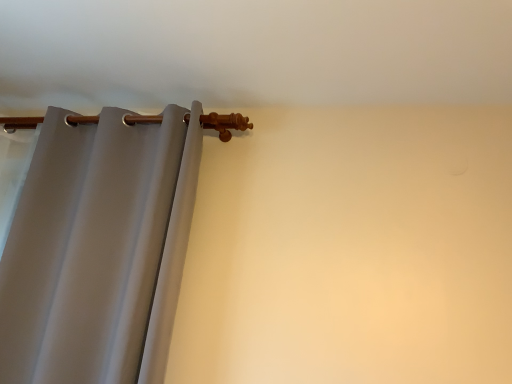
This screenshot has width=512, height=384. In order to click on satin gray curtain at left in this screenshot , I will do `click(100, 244)`.

This screenshot has width=512, height=384. What do you see at coordinates (100, 244) in the screenshot?
I see `satin gray curtain at left` at bounding box center [100, 244].

Find the location of `satin gray curtain at left`. satin gray curtain at left is located at coordinates (100, 244).